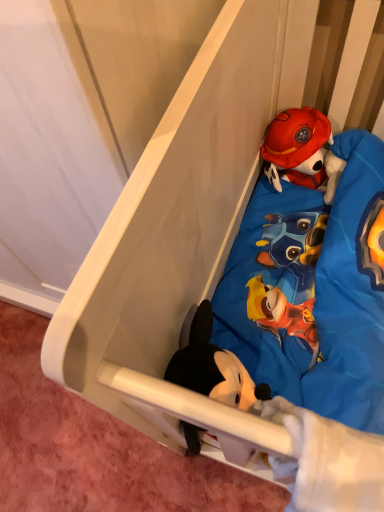
What do you see at coordinates (301, 151) in the screenshot? I see `red plush toy at upper right` at bounding box center [301, 151].

What is the approximate width of red plush toy at upper right?

It is 4.51 inches.

This screenshot has width=384, height=512. I want to click on red plush toy at upper right, so click(301, 151).

Where is `red plush toy at upper right`? This screenshot has height=512, width=384. red plush toy at upper right is located at coordinates coord(301,151).